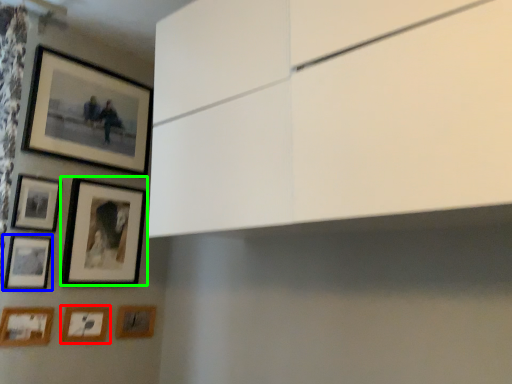
Question: Which is farther away from picture frame (highlighted by a red box)? picture frame (highlighted by a blue box) or picture frame (highlighted by a green box)?

Choices:
 (A) picture frame
 (B) picture frame

Answer: (B)